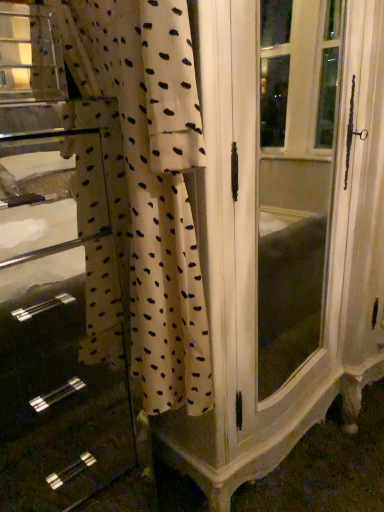
Question: Is white dotted fabric at center to the right of white fabric at left from the viewer's perspective?

Choices:
 (A) no
 (B) yes

Answer: (B)

Question: Considering the relative sizes of white dotted fabric at center and white fabric at left in the image provided, is white dotted fabric at center wider than white fabric at left?

Choices:
 (A) no
 (B) yes

Answer: (A)

Question: Is white dotted fabric at center bigger than white fabric at left?

Choices:
 (A) yes
 (B) no

Answer: (B)

Question: From a real-world perspective, is white dotted fabric at center positioned under white fabric at left based on gravity?

Choices:
 (A) no
 (B) yes

Answer: (A)

Question: From the image's perspective, is white dotted fabric at center located beneath white fabric at left?

Choices:
 (A) no
 (B) yes

Answer: (A)

Question: Is white dotted fabric at center surrounding white fabric at left?

Choices:
 (A) yes
 (B) no

Answer: (B)

Question: Is white fabric at left positioned in front of white dotted fabric at center?

Choices:
 (A) yes
 (B) no

Answer: (B)

Question: Can we say white fabric at left lies outside white dotted fabric at center?

Choices:
 (A) no
 (B) yes

Answer: (B)

Question: Does white fabric at left have a lesser width compared to white dotted fabric at center?

Choices:
 (A) yes
 (B) no

Answer: (B)

Question: Can you confirm if white fabric at left is wider than white dotted fabric at center?

Choices:
 (A) yes
 (B) no

Answer: (A)

Question: From the image's perspective, is white fabric at left located above white dotted fabric at center?

Choices:
 (A) no
 (B) yes

Answer: (A)

Question: Considering the relative sizes of white fabric at left and white dotted fabric at center in the image provided, is white fabric at left taller than white dotted fabric at center?

Choices:
 (A) no
 (B) yes

Answer: (B)

Question: From the image's perspective, is white fabric at left positioned above or below white dotted fabric at center?

Choices:
 (A) below
 (B) above

Answer: (A)